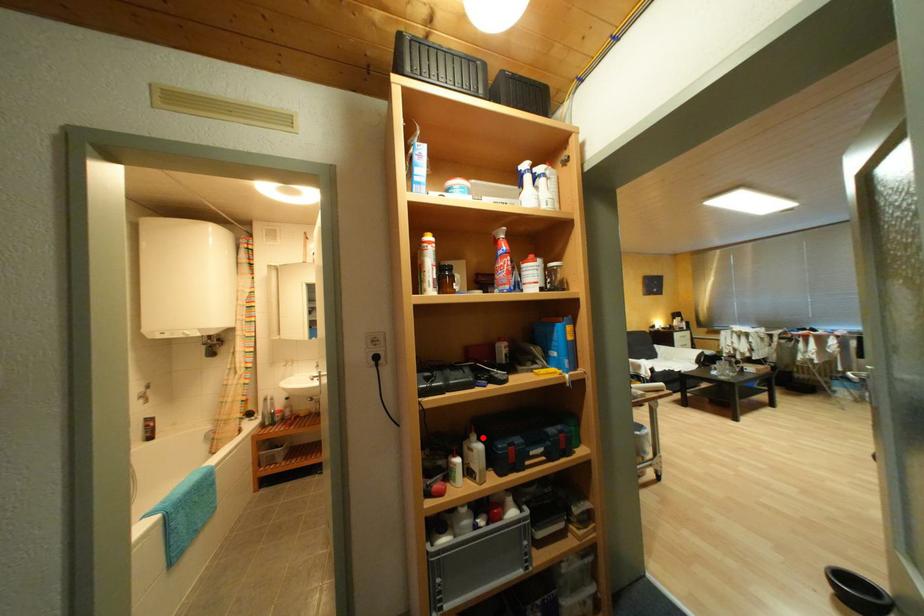
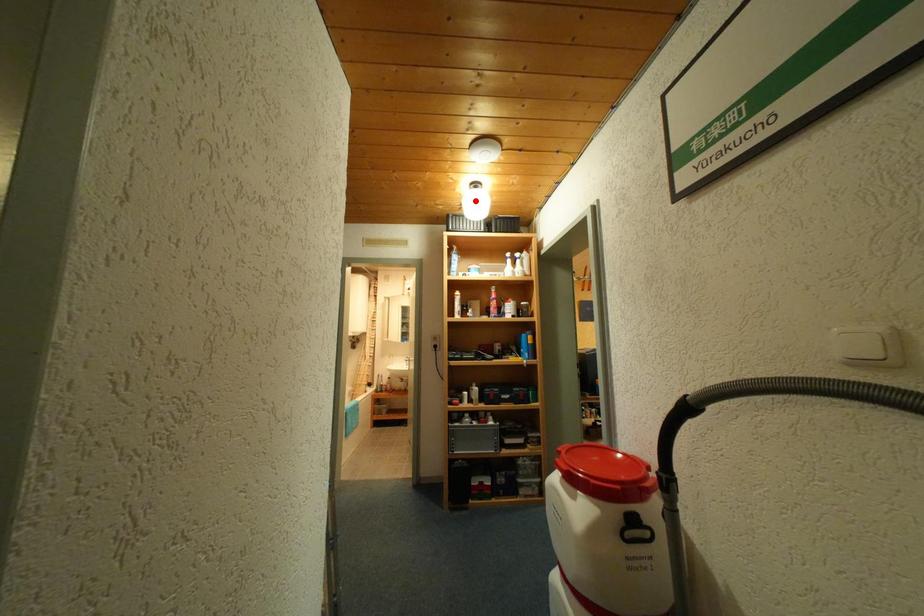
I am providing you with two images of the same scene from different viewpoints. A red point is marked on the first image and another point is marked on the second image. Does the point marked in image1 correspond to the same location as the one in image2?

No